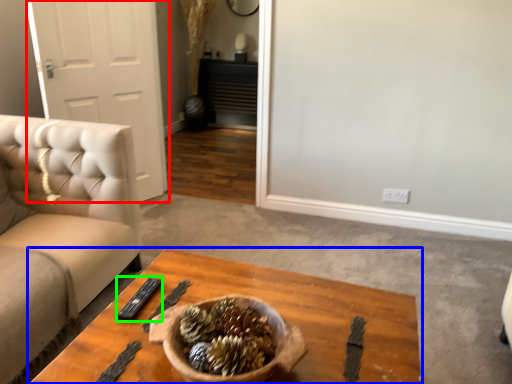
Question: Considering the real-world distances, which object is farthest from door (highlighted by a red box)? coffee table (highlighted by a blue box) or remote (highlighted by a green box)?

Choices:
 (A) coffee table
 (B) remote

Answer: (B)